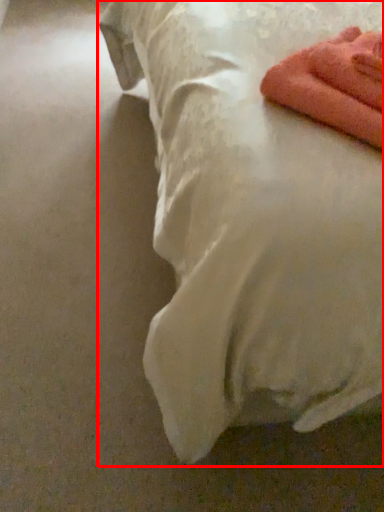
Question: Where is bed (annotated by the red box) located in relation to towel in the image?

Choices:
 (A) left
 (B) right

Answer: (A)